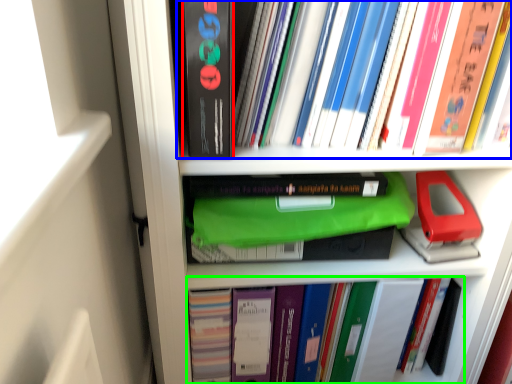
Question: Which object is the closest to the paperback book (highlighted by a red box)? Choose among these: book (highlighted by a blue box) or book (highlighted by a green box).

Choices:
 (A) book
 (B) book

Answer: (A)